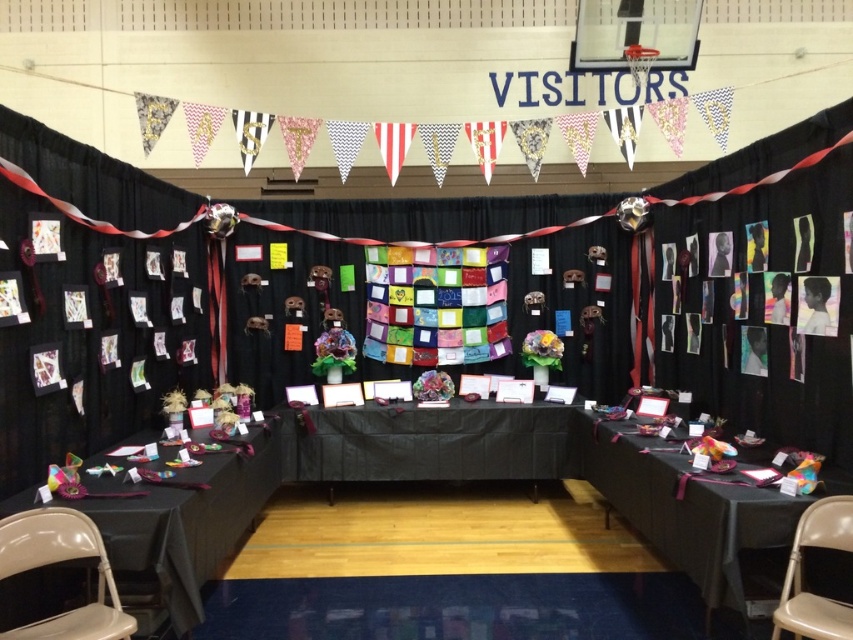
Question: Can you confirm if matte beige chair at lower left is bigger than beige fabric chair at lower right?

Choices:
 (A) yes
 (B) no

Answer: (A)

Question: Which point is closer to the camera?

Choices:
 (A) matte beige chair at lower left
 (B) matte black table at lower right

Answer: (A)

Question: Among these objects, which one is nearest to the camera?

Choices:
 (A) matte black table at lower right
 (B) shiny metallic decorations at left
 (C) beige fabric chair at lower right

Answer: (C)

Question: Does matte black table at lower right lie behind matte beige chair at lower left?

Choices:
 (A) yes
 (B) no

Answer: (A)

Question: Does matte beige chair at lower left appear under beige fabric chair at lower right?

Choices:
 (A) no
 (B) yes

Answer: (B)

Question: Which object is positioned closest to the matte black table at lower right?

Choices:
 (A) matte beige chair at lower left
 (B) shiny metallic decorations at left

Answer: (B)